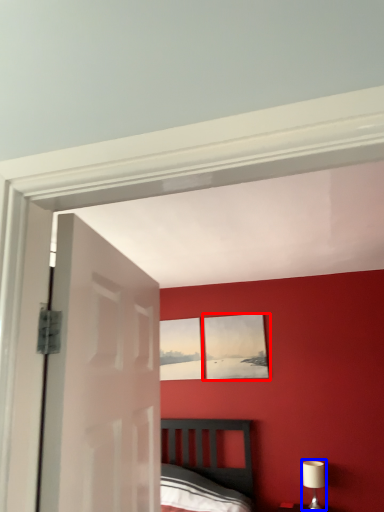
Question: Which of the following is the closest to the observer, picture frame (highlighted by a red box) or table lamp (highlighted by a blue box)?

Choices:
 (A) picture frame
 (B) table lamp

Answer: (B)